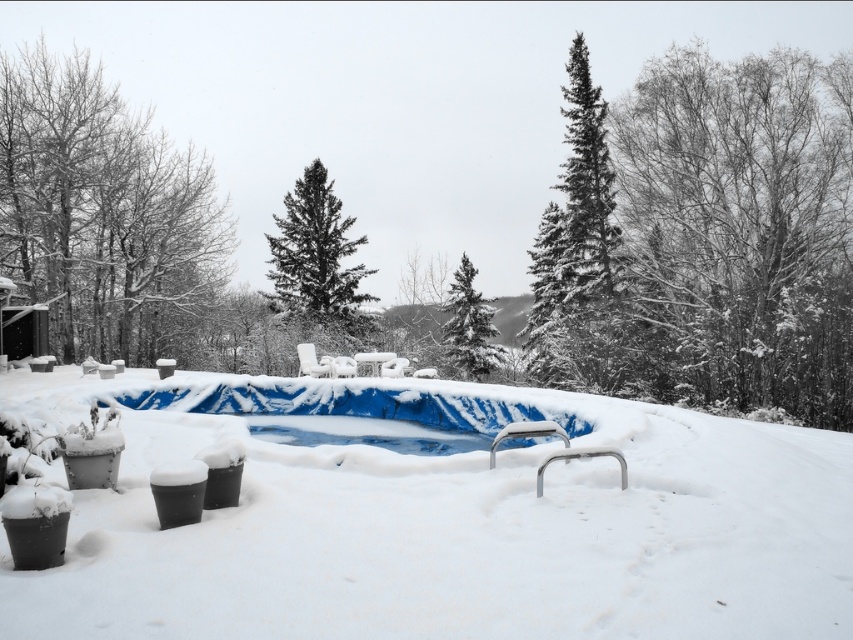
Does white fluffy snow at center appear over snow-covered evergreen tree at center?

No, white fluffy snow at center is not above snow-covered evergreen tree at center.

Is white fluffy snow at center thinner than snow-covered evergreen tree at center?

No.

Which is in front, point (236, 572) or point (471, 355)?

Positioned in front is point (236, 572).

This screenshot has width=853, height=640. What are the coordinates of `white fluffy snow at center` in the screenshot? It's located at (451, 531).

Consider the image. Is snow-covered evergreen tree at upper right to the left of dark green textured evergreen tree at center from the viewer's perspective?

In fact, snow-covered evergreen tree at upper right is to the right of dark green textured evergreen tree at center.

Which is behind, point (569, 104) or point (347, 220)?

Point (347, 220)

Locate an element on the screen. The width and height of the screenshot is (853, 640). snow-covered evergreen tree at upper right is located at coordinates (579, 257).

Does snow-covered evergreen at upper right come behind snow-covered evergreen tree at center?

That is False.

Can you confirm if snow-covered evergreen at upper right is bigger than snow-covered evergreen tree at center?

Yes.

Does point (831, 173) lie in front of point (456, 358)?

Yes.

Find the location of a particular element. snow-covered evergreen at upper right is located at coordinates (743, 224).